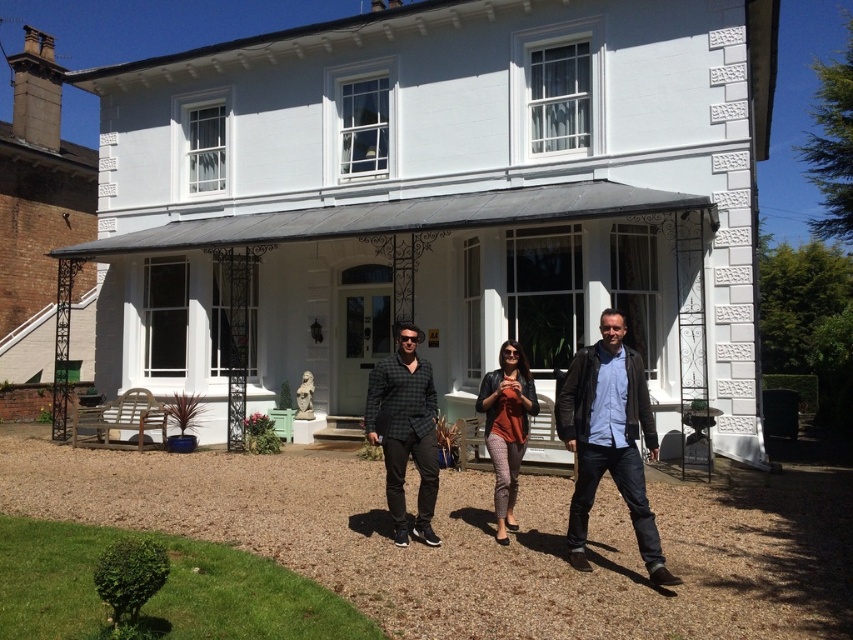
Question: Does leather jacket at center appear on the right side of matte orange top at center?

Choices:
 (A) yes
 (B) no

Answer: (A)

Question: Which of the following is the closest to the observer?

Choices:
 (A) matte orange top at center
 (B) leather jacket at center
 (C) checkered fabric shirt at center

Answer: (B)

Question: Which is farther from the matte black jacket at center?

Choices:
 (A) matte orange top at center
 (B) leather jacket at center
 (C) checkered fabric shirt at center

Answer: (C)

Question: Does matte black jacket at center have a smaller size compared to leather jacket at center?

Choices:
 (A) no
 (B) yes

Answer: (A)

Question: Which object appears closest to the camera in this image?

Choices:
 (A) checkered fabric shirt at center
 (B) matte orange top at center

Answer: (A)

Question: Is matte black jacket at center bigger than checkered fabric shirt at center?

Choices:
 (A) no
 (B) yes

Answer: (B)